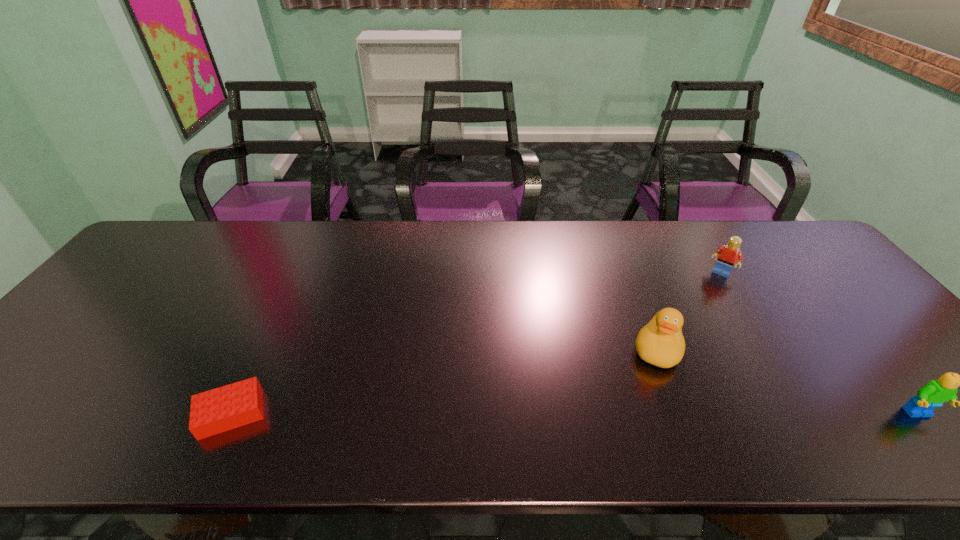
The height and width of the screenshot is (540, 960). I want to click on vacant space situated on the front-facing side of the third object from left to right, so click(693, 316).

Find the location of `vacant space situated on the front-facing side of the third object from left to right`. vacant space situated on the front-facing side of the third object from left to right is located at coordinates (670, 354).

The height and width of the screenshot is (540, 960). I want to click on object situated at the far edge, so click(729, 254).

Image resolution: width=960 pixels, height=540 pixels. What are the coordinates of `object present at the right edge` in the screenshot? It's located at (936, 392).

The image size is (960, 540). Identify the location of object present at the near right corner. (936, 392).

In the image, there is a desktop. Where is `vacant space at the far edge`? vacant space at the far edge is located at coordinates (349, 242).

The image size is (960, 540). I want to click on free region at the near edge of the desktop, so click(726, 396).

You are a GUI agent. You are given a task and a screenshot of the screen. Output one action in this format:
    pyautogui.click(x=<x>, y=<y>)
    Task: Click on the vacant point at the left edge
    The height and width of the screenshot is (540, 960).
    Given the screenshot: What is the action you would take?
    pyautogui.click(x=144, y=302)

Locate an element on the screen. This screenshot has height=540, width=960. free spot at the far left corner of the desktop is located at coordinates (133, 261).

Identify the location of free spot at the far right corner of the desktop. (756, 229).